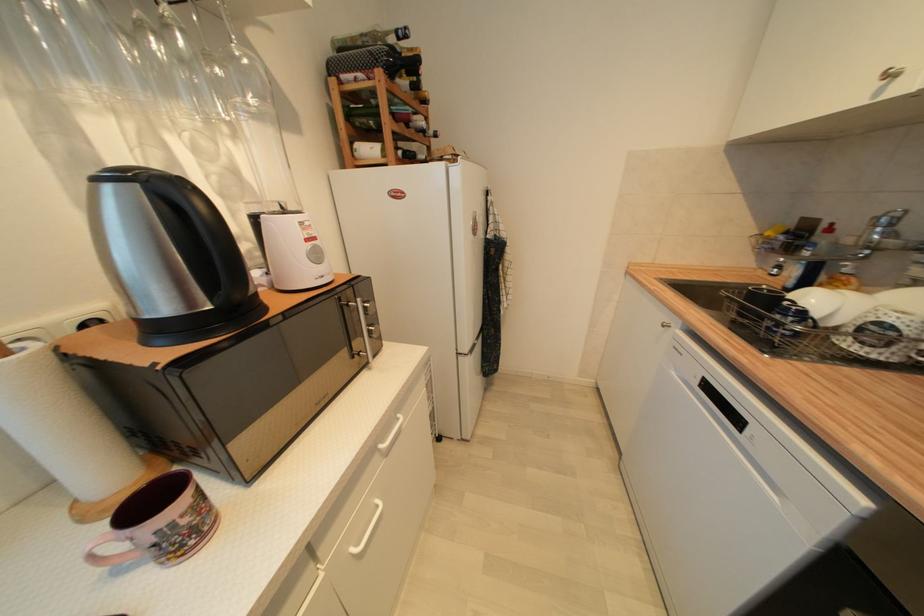
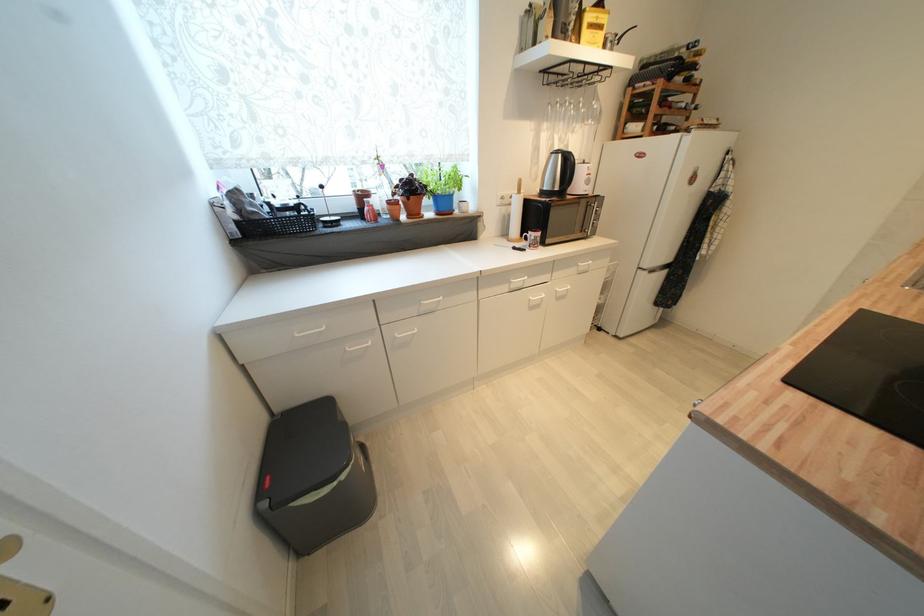
In the second image, find the point that corresponds to point 86,92 in the first image.

(551, 127)